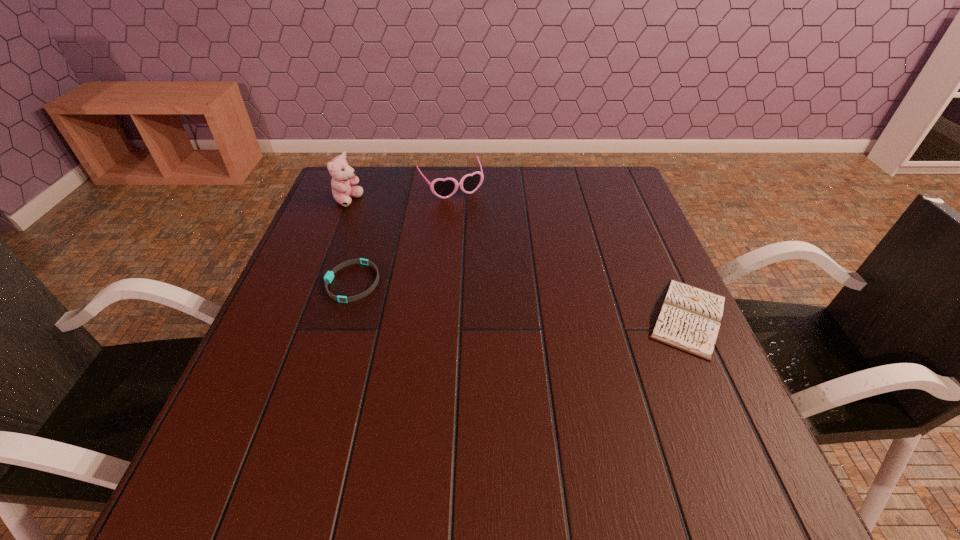
You are a GUI agent. You are given a task and a screenshot of the screen. Output one action in this format:
    pyautogui.click(x=<x>, y=<y>)
    Task: Click on the free space on the desktop that is between the wristband and the rightmost object and is positioned at the face of the tallest object
    This screenshot has height=540, width=960.
    Given the screenshot: What is the action you would take?
    498,297

Where is `vacant space on the desktop that is between the wristband and the diary and is positioned on the front-facing side of the third object from left to right`? vacant space on the desktop that is between the wristband and the diary and is positioned on the front-facing side of the third object from left to right is located at coordinates (516, 299).